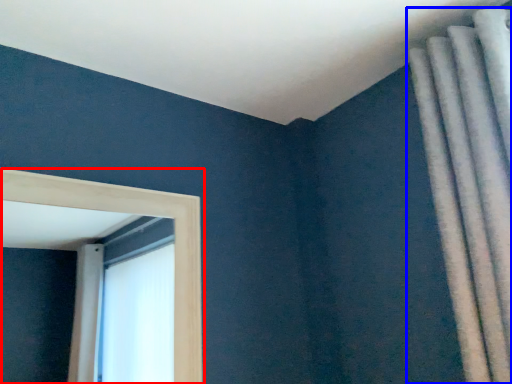
Question: Among these objects, which one is farthest to the camera, window (highlighted by a red box) or curtain (highlighted by a blue box)?

Choices:
 (A) window
 (B) curtain

Answer: (A)